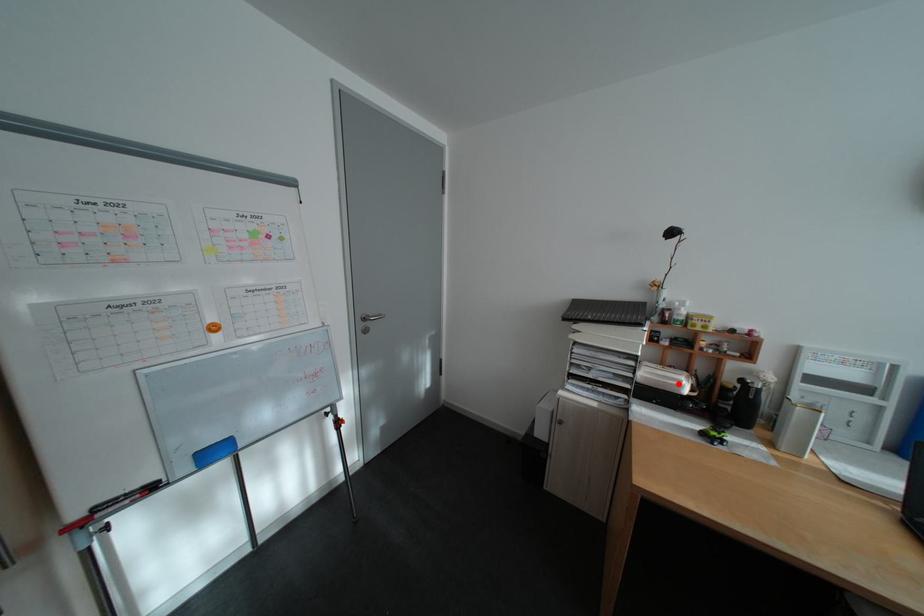
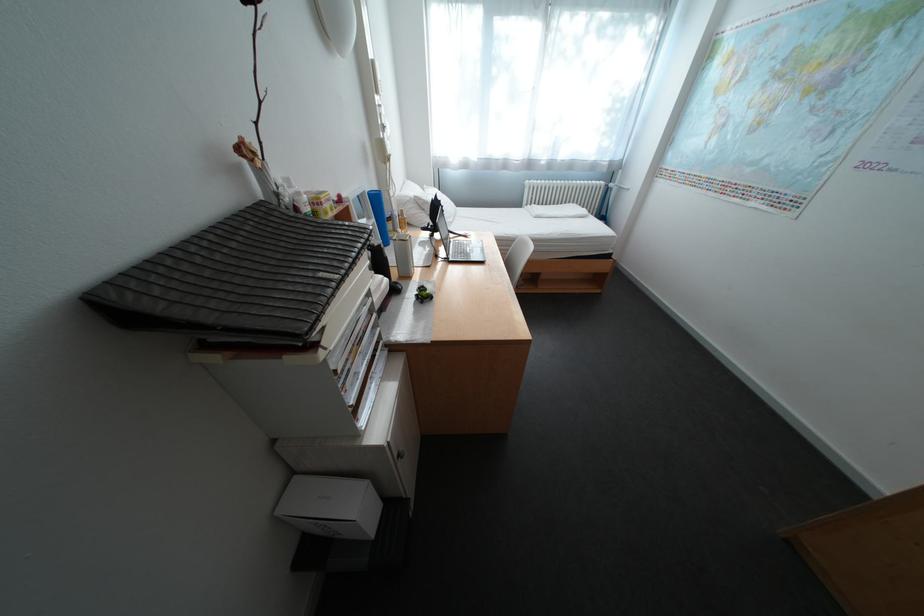
Question: A red point is marked in image1. In image2, is the corresponding 3D point closer to the camera or farther? Reply with the corresponding letter.

Choices:
 (A) The corresponding 3D point is closer.
 (B) The corresponding 3D point is farther.

Answer: (A)